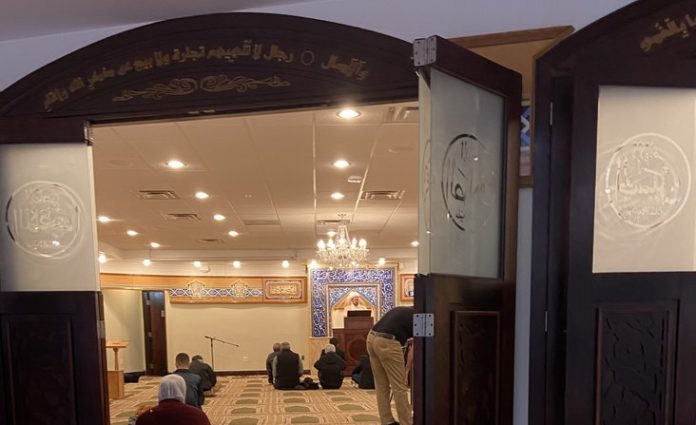
This screenshot has width=696, height=425. Identify the location of floor. (275, 412).